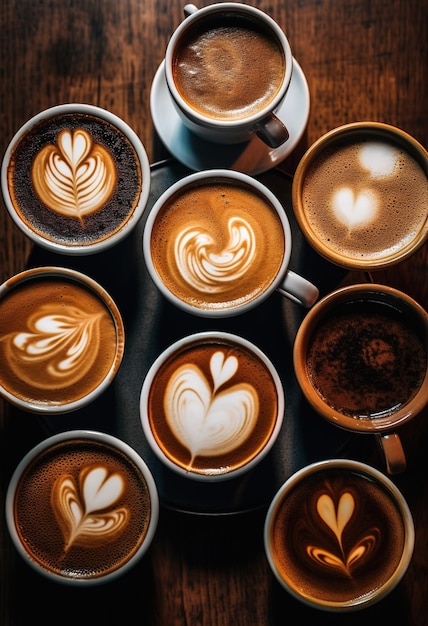
The width and height of the screenshot is (428, 626). In order to click on coffee cups without a handle visible in this screenshot , I will do `click(122, 134)`, `click(400, 144)`, `click(108, 322)`, `click(263, 381)`, `click(354, 481)`, `click(135, 476)`.